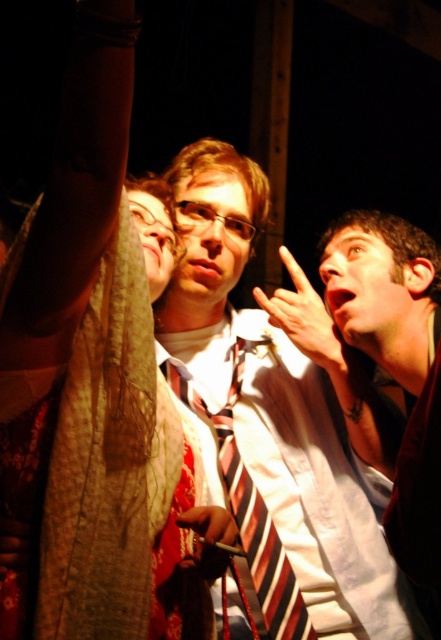
You are standing in the center of the room and want to adjust your striped tie at center. Which direction should you move to reach it?

The striped tie at center is already at your current position, so you don